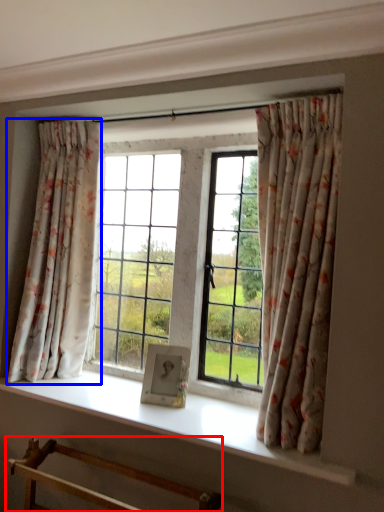
Question: Which object is further to the camera taking this photo, furniture (highlighted by a red box) or curtain (highlighted by a blue box)?

Choices:
 (A) furniture
 (B) curtain

Answer: (B)